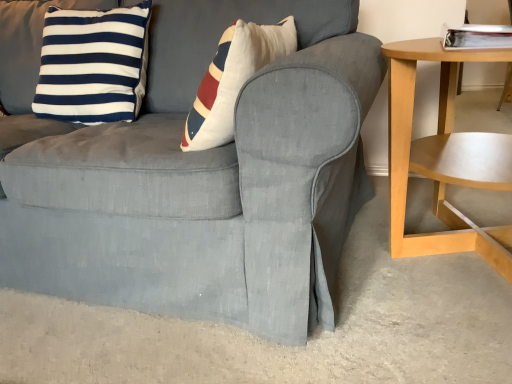
Question: In terms of height, does navy blue/white striped cushion at upper left look taller or shorter compared to matte gray slipcover at center?

Choices:
 (A) tall
 (B) short

Answer: (B)

Question: In terms of size, does navy blue/white striped cushion at upper left appear bigger or smaller than matte gray slipcover at center?

Choices:
 (A) big
 (B) small

Answer: (B)

Question: Which of these objects is positioned closest to the light wood/woodenobject at right?

Choices:
 (A) navy blue/white striped cushion at upper left
 (B) matte gray slipcover at center

Answer: (B)

Question: Which object is the farthest from the matte gray slipcover at center?

Choices:
 (A) light wood/woodenobject at right
 (B) navy blue/white striped cushion at upper left

Answer: (A)